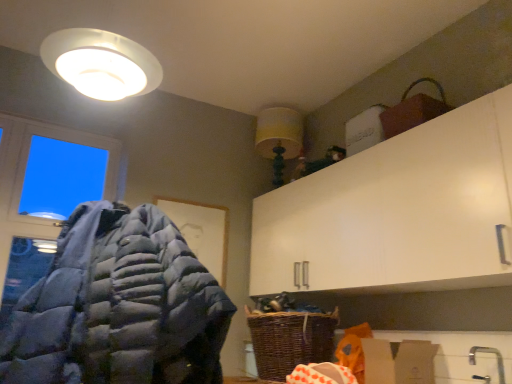
Question: Is yellow fabric lampshade at upper center next to transparent glass window at upper left and touching it?

Choices:
 (A) no
 (B) yes

Answer: (A)

Question: Can you confirm if yellow fabric lampshade at upper center is wider than transparent glass window at upper left?

Choices:
 (A) no
 (B) yes

Answer: (B)

Question: Is yellow fabric lampshade at upper center thinner than transparent glass window at upper left?

Choices:
 (A) yes
 (B) no

Answer: (B)

Question: Does yellow fabric lampshade at upper center appear on the right side of transparent glass window at upper left?

Choices:
 (A) no
 (B) yes

Answer: (B)

Question: Is yellow fabric lampshade at upper center shorter than transparent glass window at upper left?

Choices:
 (A) no
 (B) yes

Answer: (B)

Question: Is yellow fabric lampshade at upper center bigger than transparent glass window at upper left?

Choices:
 (A) no
 (B) yes

Answer: (A)

Question: From a real-world perspective, does brown cardboard box at lower right stand above transparent glass window at upper left?

Choices:
 (A) no
 (B) yes

Answer: (A)

Question: Does brown cardboard box at lower right have a lesser width compared to transparent glass window at upper left?

Choices:
 (A) yes
 (B) no

Answer: (B)

Question: Is brown cardboard box at lower right to the right of transparent glass window at upper left from the viewer's perspective?

Choices:
 (A) no
 (B) yes

Answer: (B)

Question: Does brown cardboard box at lower right appear on the left side of transparent glass window at upper left?

Choices:
 (A) yes
 (B) no

Answer: (B)

Question: Is brown cardboard box at lower right located outside transparent glass window at upper left?

Choices:
 (A) yes
 (B) no

Answer: (A)

Question: Is brown cardboard box at lower right wider than transparent glass window at upper left?

Choices:
 (A) yes
 (B) no

Answer: (A)

Question: Considering the relative positions of woven brown basket at lower center and gray down jacket at left in the image provided, is woven brown basket at lower center to the left of gray down jacket at left from the viewer's perspective?

Choices:
 (A) yes
 (B) no

Answer: (B)